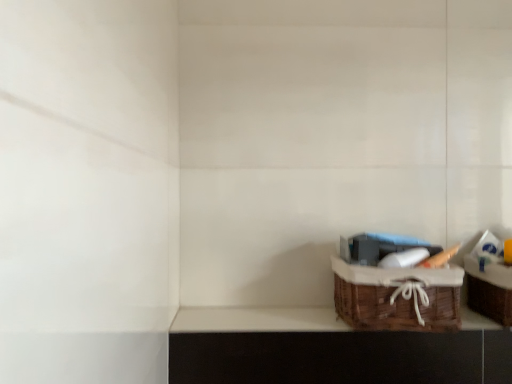
Question: Considering the positions of woven brown basket at lower right and woven brown picnic basket at lower right in the image, is woven brown basket at lower right wider or thinner than woven brown picnic basket at lower right?

Choices:
 (A) thin
 (B) wide

Answer: (B)

Question: Relative to woven brown picnic basket at lower right, is woven brown basket at lower right in front or behind?

Choices:
 (A) behind
 (B) front

Answer: (A)

Question: Estimate the real-world distances between objects in this image. Which object is farther from the woven brown picnic basket at lower right?

Choices:
 (A) woven brown basket at lower right
 (B) brown wicker basket at lower right

Answer: (A)

Question: Which object is the farthest from the woven brown basket at lower right?

Choices:
 (A) woven brown picnic basket at lower right
 (B) brown wicker basket at lower right

Answer: (B)